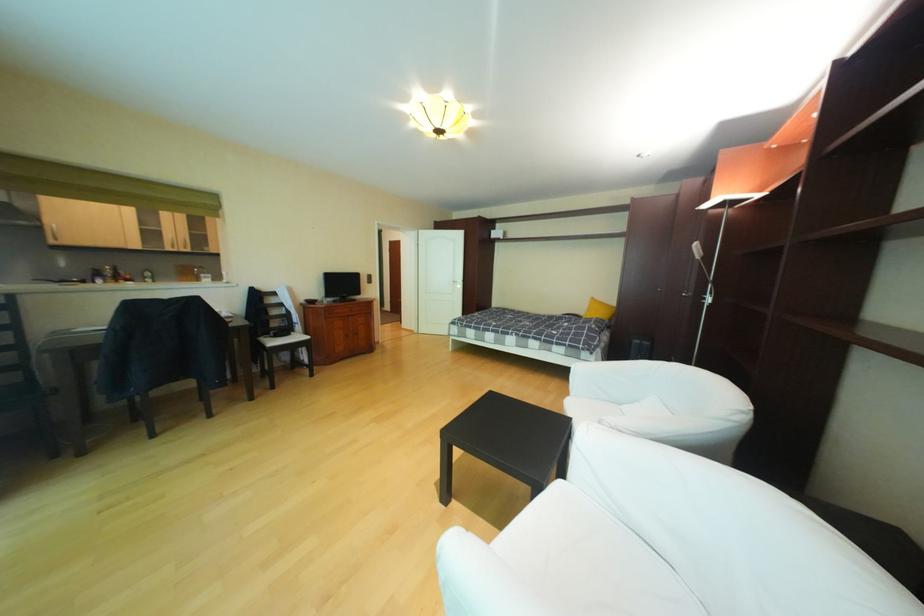
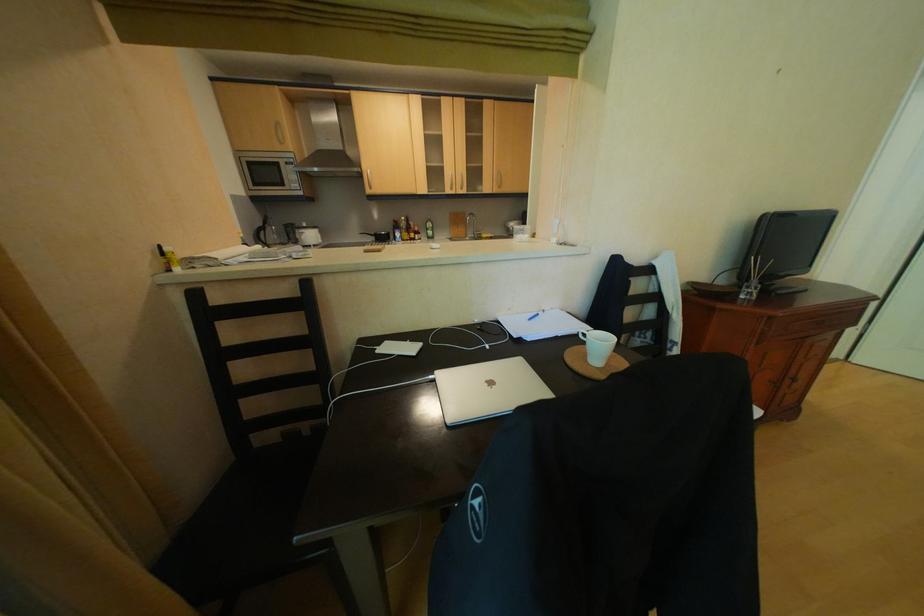
Locate, in the second image, the point that corresponds to [164,235] in the first image.

(446, 174)